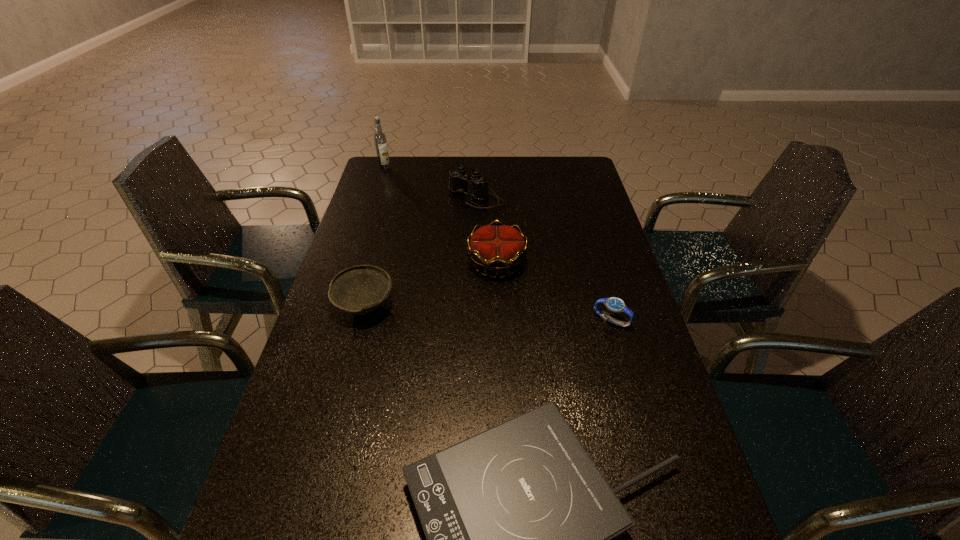
In order to click on free space located on the front of the watch in this screenshot , I will do `click(621, 356)`.

Find the location of a particular element. The image size is (960, 540). vodka positioned at the far edge is located at coordinates (380, 138).

Locate an element on the screen. This screenshot has width=960, height=540. binoculars that is at the far edge is located at coordinates (458, 179).

Where is `vodka positioned at the left edge`? The image size is (960, 540). vodka positioned at the left edge is located at coordinates (380, 138).

In order to click on bowl that is at the left edge in this screenshot , I will do `click(361, 289)`.

Locate an element on the screen. The image size is (960, 540). object situated at the right edge is located at coordinates (614, 304).

Where is `object located in the far left corner section of the desktop`? This screenshot has width=960, height=540. object located in the far left corner section of the desktop is located at coordinates (380, 138).

Where is `free space at the far edge of the desktop`? The image size is (960, 540). free space at the far edge of the desktop is located at coordinates (496, 162).

The width and height of the screenshot is (960, 540). What are the coordinates of `vacant area at the left edge` in the screenshot? It's located at (330, 309).

Identify the location of free point at the right edge. (624, 342).